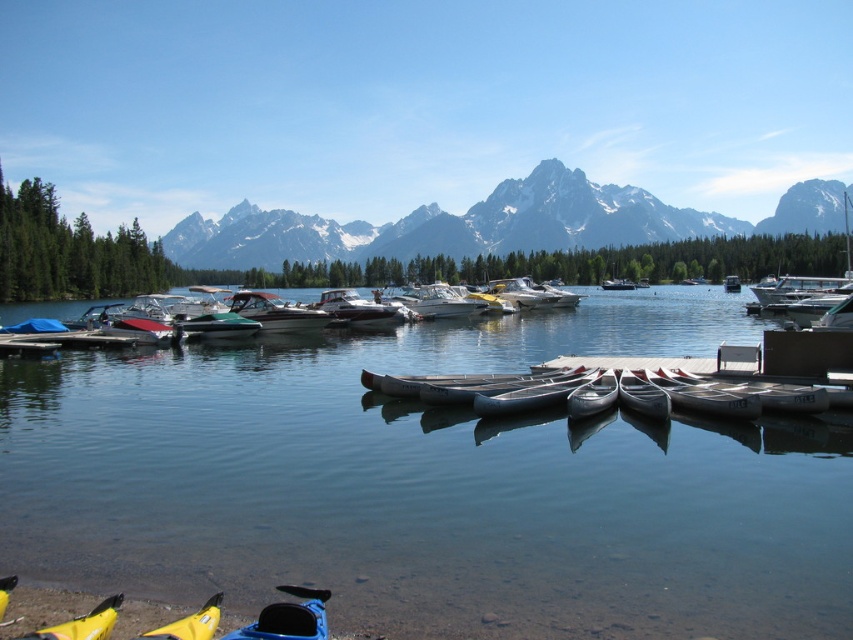
You are a photographer planning to capture the reflection of the metallic silver canoe at center and the white plastic boat at center in the lake. Based on their positions, which boat will have its reflection closer to the left side of the photo?

The metallic silver canoe at center is positioned to the left of the white plastic boat at center, so its reflection will also be closer to the left side of the photo.

You are standing at the lakeside and want to determine which of the two points, point (595, 310) or point (450, 308), is closer to you. Based on the scene, which point is nearer?

Point (595, 310) is further to the viewer than point (450, 308), so the closer point to you is point (450, 308).